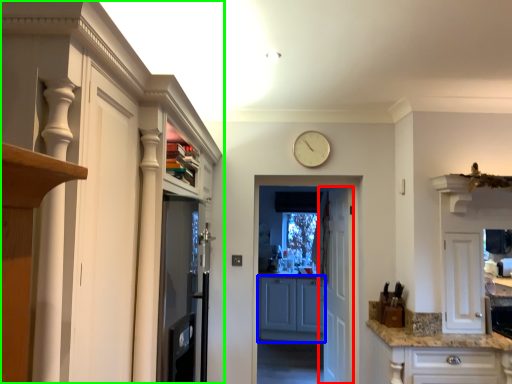
Question: Which object is positioned closest to door (highlighted by a red box)? Select from cabinetry (highlighted by a blue box) and cabinetry (highlighted by a green box).

Choices:
 (A) cabinetry
 (B) cabinetry

Answer: (A)